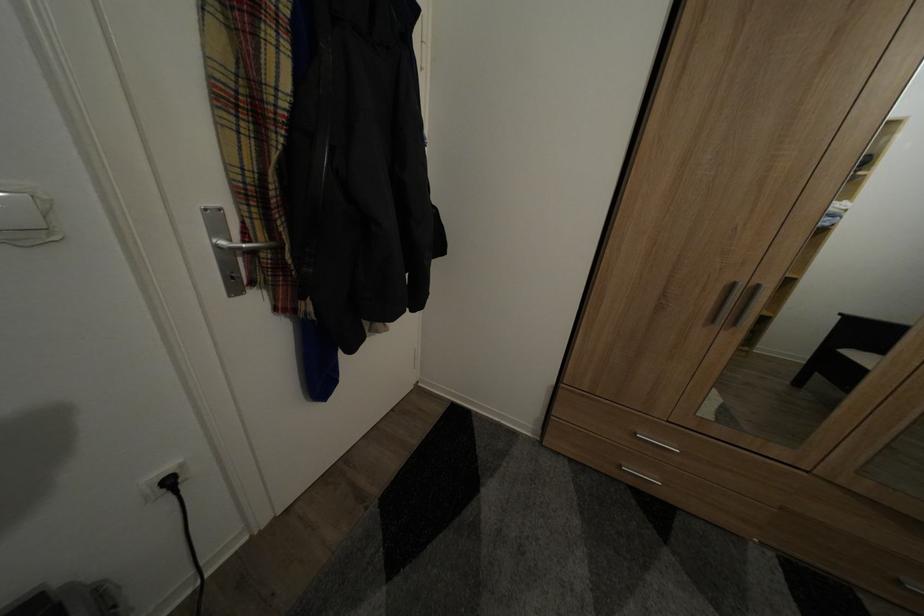
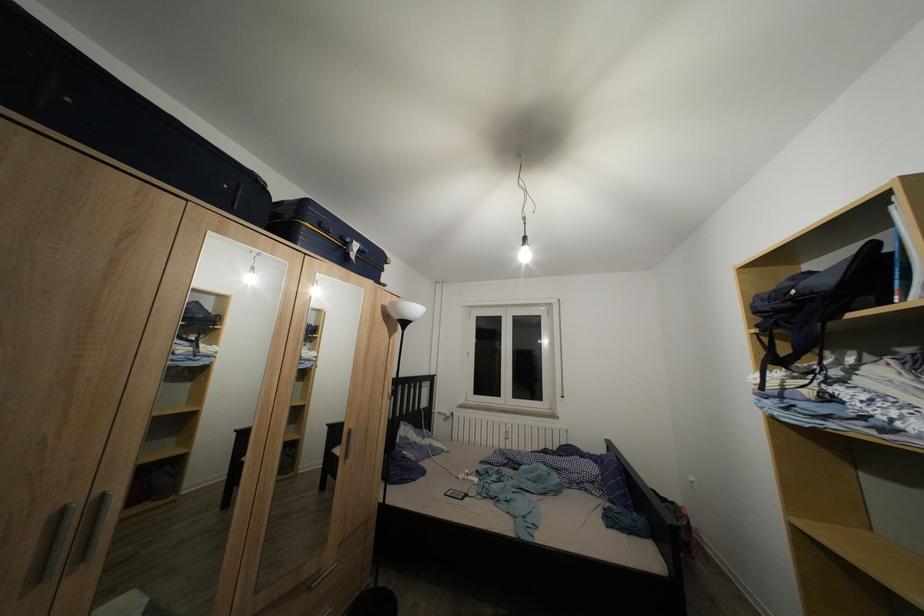
The point at (766, 293) is marked in the first image. Where is the corresponding point in the second image?

(111, 503)